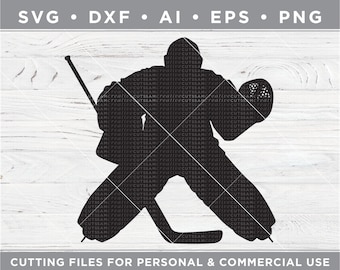
Locate an element on the screen. The height and width of the screenshot is (270, 340). chest is located at coordinates (183, 106).